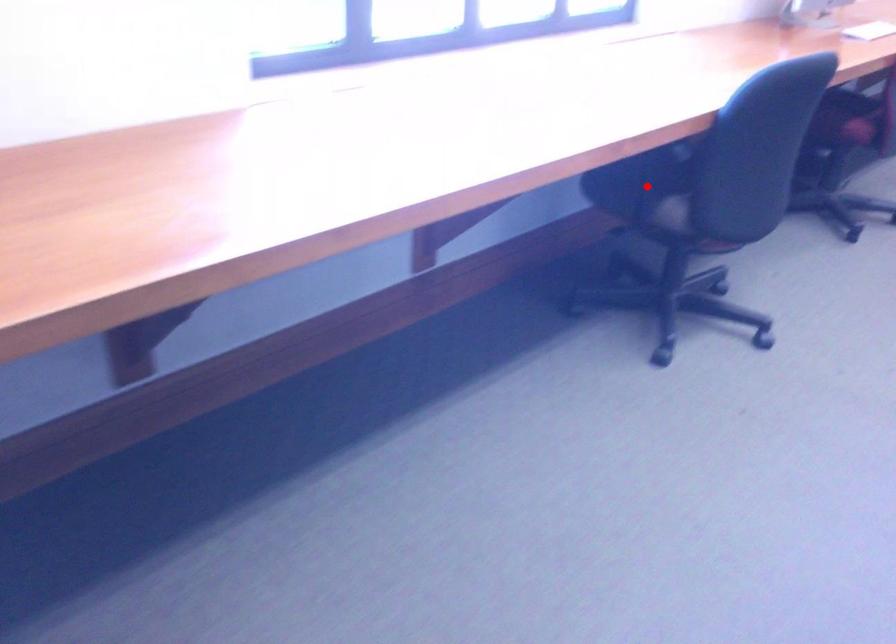
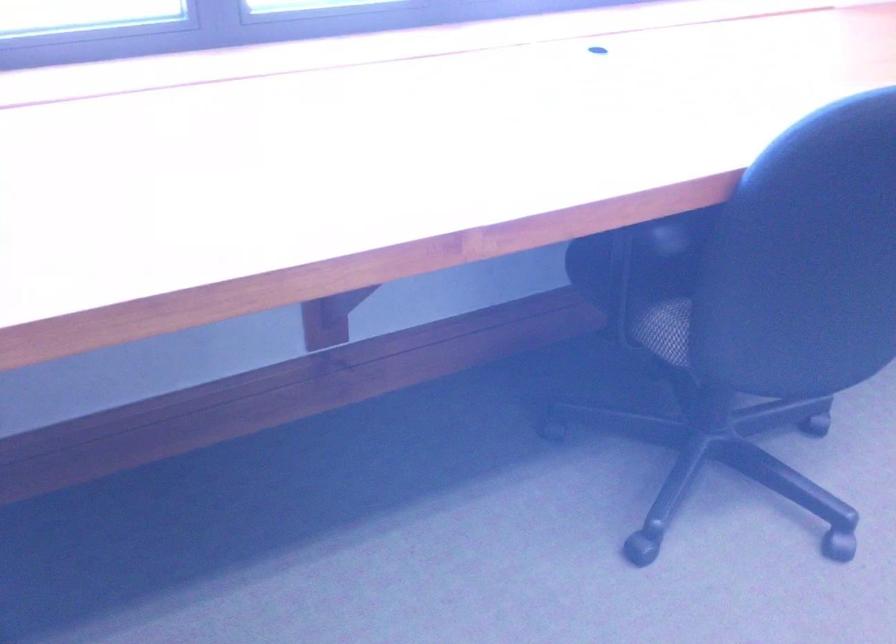
Question: I am providing you with two images of the same scene from different viewpoints. A red point is shown in image1. For the corresponding object point in image2, is it positioned nearer or farther from the camera?

Choices:
 (A) Nearer
 (B) Farther

Answer: (A)